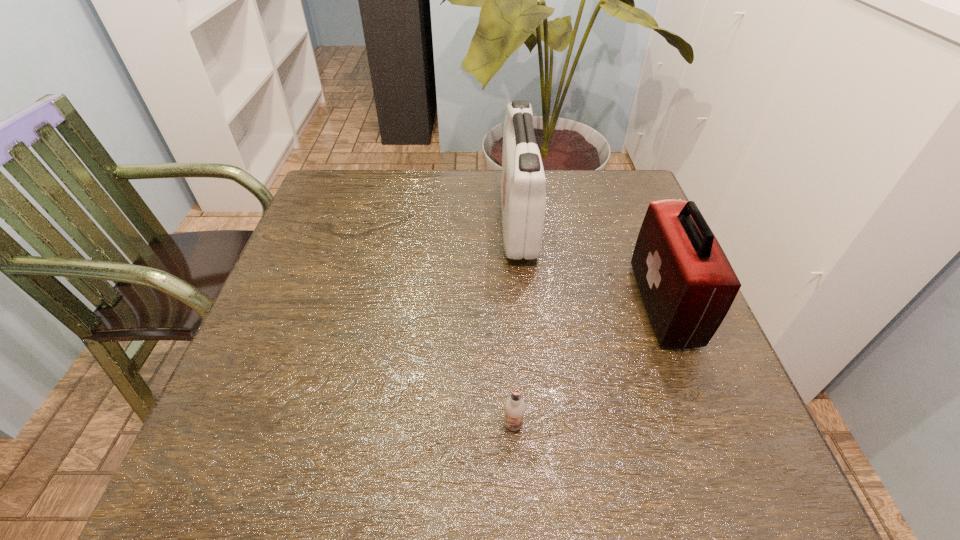
Locate an element on the screen. The width and height of the screenshot is (960, 540). the left first aid kit is located at coordinates (523, 194).

Identify the location of the rightmost object. (687, 284).

Image resolution: width=960 pixels, height=540 pixels. I want to click on the nearest object, so click(514, 406).

The image size is (960, 540). In order to click on chocolate milk in this screenshot , I will do `click(514, 406)`.

At what (x,y) coordinates should I click in order to perform the action: click on vacant space located 0.340m on the front side of the left first aid kit. Please return your answer as a coordinate pair (x, y). The height and width of the screenshot is (540, 960). Looking at the image, I should click on (371, 221).

Find the location of a particular element. The image size is (960, 540). free location located 0.140m on the front side of the left first aid kit is located at coordinates (447, 221).

Identify the location of vacant point located on the front side of the left first aid kit. (436, 221).

Find the location of `vacant space located 0.160m on the side of the rightmost object with the cross symbol`. vacant space located 0.160m on the side of the rightmost object with the cross symbol is located at coordinates (565, 305).

Find the location of a particular element. This screenshot has height=540, width=960. free space located 0.250m on the side of the rightmost object with the cross symbol is located at coordinates (523, 305).

At what (x,y) coordinates should I click in order to perform the action: click on free location located on the side of the rightmost object with the cross symbol. Please return your answer as a coordinate pair (x, y). This screenshot has height=540, width=960. Looking at the image, I should click on (612, 305).